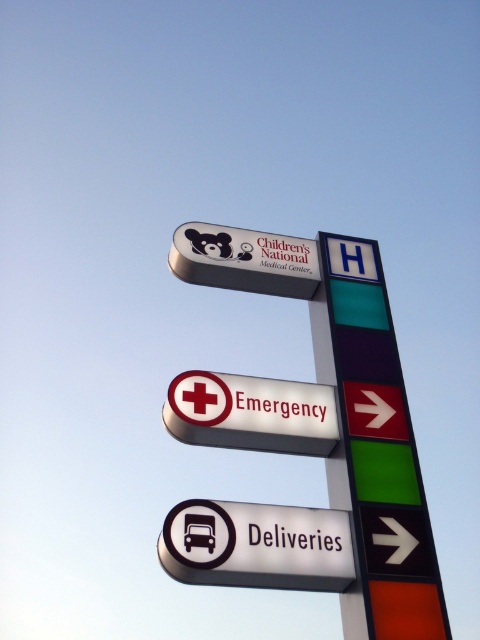
Question: Among these objects, which one is nearest to the camera?

Choices:
 (A) green plastic pole at center
 (B) white plastic sign at lower center

Answer: (B)

Question: Which of the following is the farthest from the observer?

Choices:
 (A) matte white sign at upper center
 (B) white plastic sign at lower center

Answer: (A)

Question: Does white plastic sign at lower center appear over matte white sign at upper center?

Choices:
 (A) no
 (B) yes

Answer: (A)

Question: Does white plastic sign at lower center have a lesser width compared to green plastic pole at center?

Choices:
 (A) no
 (B) yes

Answer: (B)

Question: Among these points, which one is farthest from the camera?

Choices:
 (A) (314, 262)
 (B) (323, 353)

Answer: (A)

Question: From the image, what is the correct spatial relationship of white plastic sign at lower center in relation to matte white sign at upper center?

Choices:
 (A) left
 (B) right

Answer: (A)